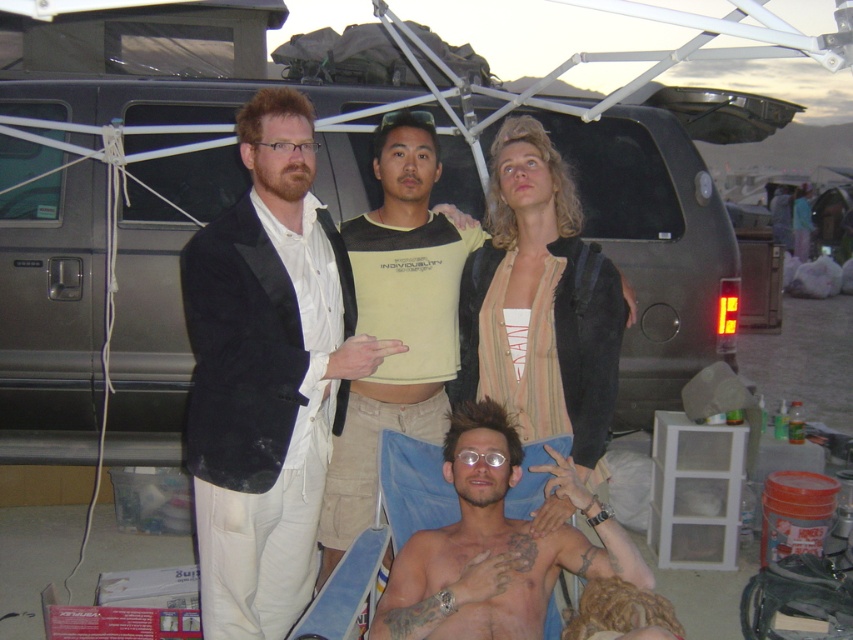
Between point (590, 406) and point (389, 227), which one is positioned in front?

Point (590, 406) is more forward.

Is point (575, 368) farther from viewer compared to point (451, 209)?

No, it is in front of (451, 209).

Is point (469, 371) positioned before point (379, 422)?

That is False.

Identify the location of striped fabric shirt at upper center. Image resolution: width=853 pixels, height=640 pixels. (540, 305).

Is matte black suit at center above striped fabric shirt at upper center?

No, matte black suit at center is not above striped fabric shirt at upper center.

Does matte black suit at center come behind striped fabric shirt at upper center?

No, it is not.

Is point (302, 380) behind point (572, 250)?

No, (302, 380) is in front of (572, 250).

Where is `matte black suit at center`? The width and height of the screenshot is (853, 640). matte black suit at center is located at coordinates (265, 374).

Which is more to the left, metallic silver suv at center or light yellow jersey at center?

metallic silver suv at center

Which is in front, point (641, 262) or point (370, 419)?

Point (370, 419)

The image size is (853, 640). I want to click on metallic silver suv at center, so click(654, 246).

What are the coordinates of `metallic silver suv at center` in the screenshot? It's located at 654,246.